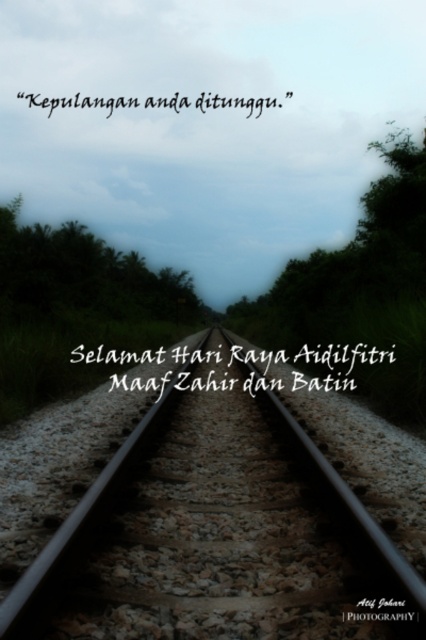
You are a graphic designer reviewing a poster design. The poster has two texts displayed on it. The first is the black paper text at center, and the second is the black matte text at upper center. Which text is wider?

The black paper text at center might be wider than black matte text at upper center according to the description.

You are a hiker who has just arrived at the railway tracks shown in the image. You notice a black paper text located at point (x=342, y=362). Can you read the text from your current position?

The black paper text at center is located at point (x=342, y=362), so yes, you can read the text from your current position as it is positioned at the center of the image.

You are a maintenance worker who needs to place a 4 meter long safety barrier between the smooth metal train track at center and the black paper text at center. Can you fit the barrier between them without overlapping either object?

The smooth metal train track at center and black paper text at center are 3.88 meters apart from each other. Since the barrier is 4 meters long, it cannot fit between them without overlapping either object.